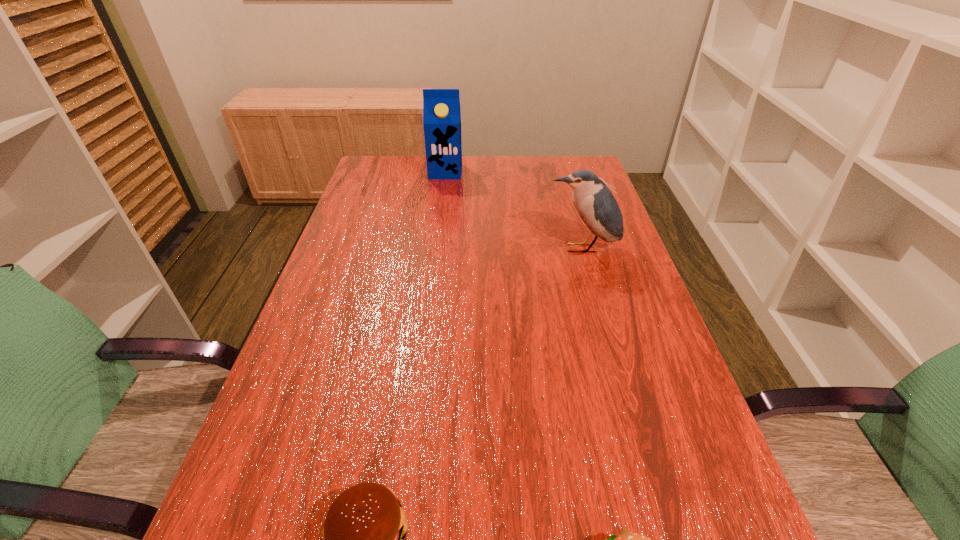
You are a GUI agent. You are given a task and a screenshot of the screen. Output one action in this format:
    pyautogui.click(x=<x>, y=<y>)
    Task: Click on the vacant space at the right edge
    This screenshot has height=540, width=960.
    Given the screenshot: What is the action you would take?
    pyautogui.click(x=570, y=257)

Find the location of a particular element. This screenshot has height=540, width=960. blank space at the far left corner of the desktop is located at coordinates (401, 181).

In order to click on vacant space at the far right corner of the desktop in this screenshot , I will do pos(549,167).

Locate which object ranks third in proximity to the carton. Please provide its 2D coordinates. Your answer should be formatted as a tuple, i.e. [(x, y)], where the tuple contains the x and y coordinates of a point satisfying the conditions above.

[(626, 539)]

You are a GUI agent. You are given a task and a screenshot of the screen. Output one action in this format:
    pyautogui.click(x=<x>, y=<y>)
    Task: Click on the object identified as the second closest to the right hamburger
    The height and width of the screenshot is (540, 960).
    Given the screenshot: What is the action you would take?
    pyautogui.click(x=596, y=205)